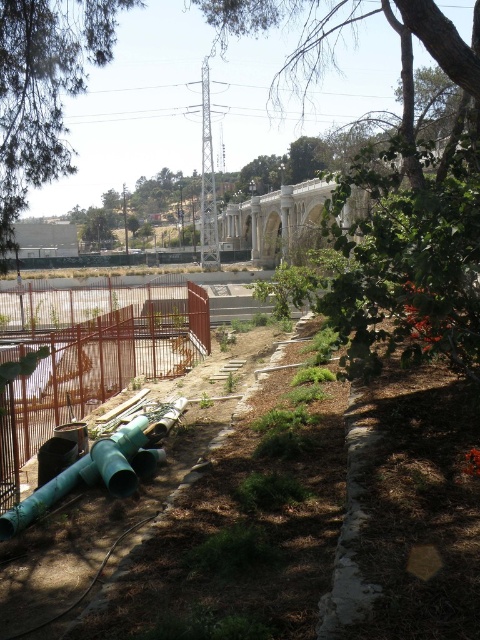
Question: Is green leafy tree at upper center positioned behind green leafy tree at upper left?

Choices:
 (A) yes
 (B) no

Answer: (B)

Question: Among these points, which one is farthest from the camera?

Choices:
 (A) (467, 148)
 (B) (103, 1)
 (C) (38, 493)

Answer: (B)

Question: Is green leafy tree at upper center wider than green matte water pipe at lower left?

Choices:
 (A) no
 (B) yes

Answer: (B)

Question: Which point is farther from the camera taking this photo?

Choices:
 (A) (478, 52)
 (B) (59, 308)

Answer: (B)

Question: Which of the following is the closest to the observer?

Choices:
 (A) (409, 61)
 (B) (154, 314)
 (C) (4, 531)
 (D) (11, 227)

Answer: (C)

Question: Is green leafy tree at upper center positioned at the back of green matte water pipe at lower left?

Choices:
 (A) no
 (B) yes

Answer: (A)